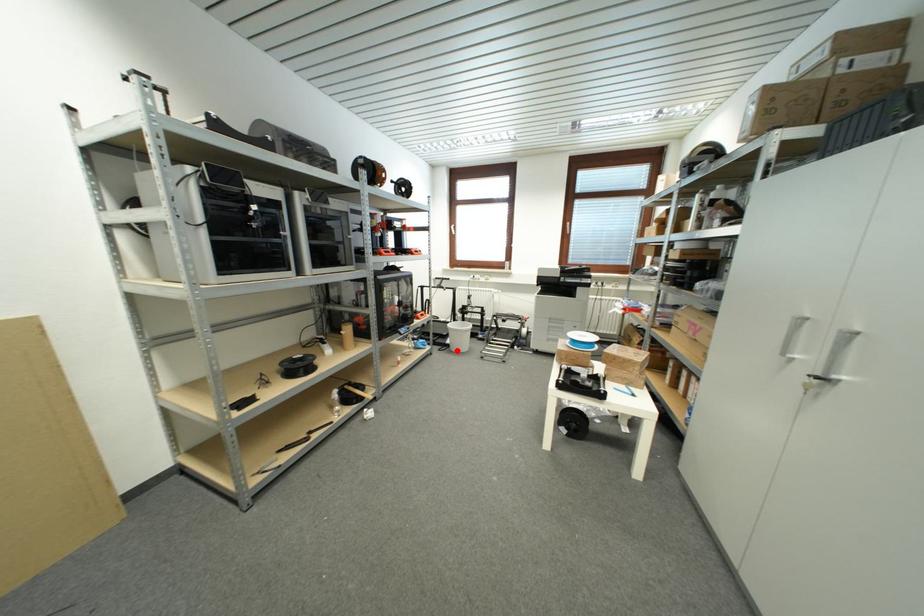
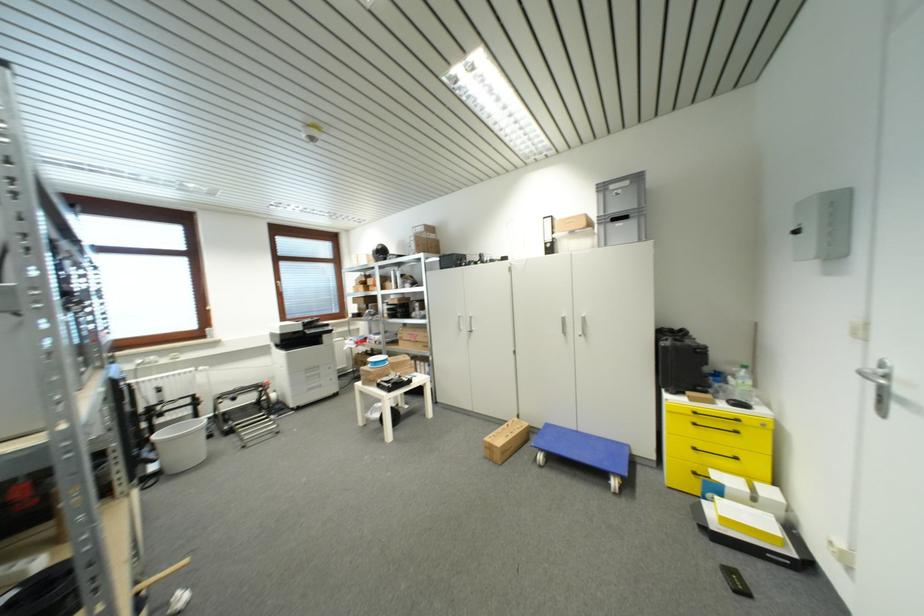
Find the pixel in the second image that matches the highlighted location in the first image.

(177, 472)